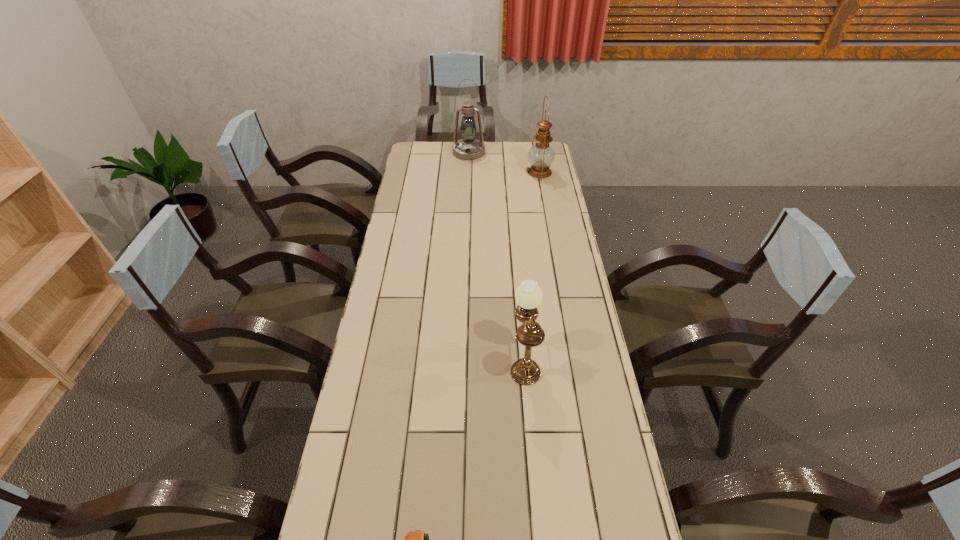
Locate an element on the screen. This screenshot has height=540, width=960. the leftmost oil lamp is located at coordinates (468, 148).

I want to click on the farthest object, so click(x=468, y=148).

Locate an element on the screen. The width and height of the screenshot is (960, 540). the second farthest oil lamp is located at coordinates (541, 155).

You are a GUI agent. You are given a task and a screenshot of the screen. Output one action in this format:
    pyautogui.click(x=<x>, y=<y>)
    Task: Click on the second farthest object
    
    Given the screenshot: What is the action you would take?
    pyautogui.click(x=541, y=155)

What are the coordinates of `the second object from right to left` in the screenshot? It's located at (525, 371).

Locate an element on the screen. the second nearest object is located at coordinates (525, 371).

Locate an element on the screen. The image size is (960, 540). free space located 0.190m on the front of the farthest object is located at coordinates (468, 181).

Locate an element on the screen. The height and width of the screenshot is (540, 960). vacant space located 0.200m on the back of the rightmost oil lamp is located at coordinates (534, 143).

This screenshot has width=960, height=540. Identify the location of vacant space located 0.390m on the front of the shortest oil lamp. (540, 532).

Locate an element on the screen. This screenshot has width=960, height=540. object that is at the right edge is located at coordinates (541, 155).